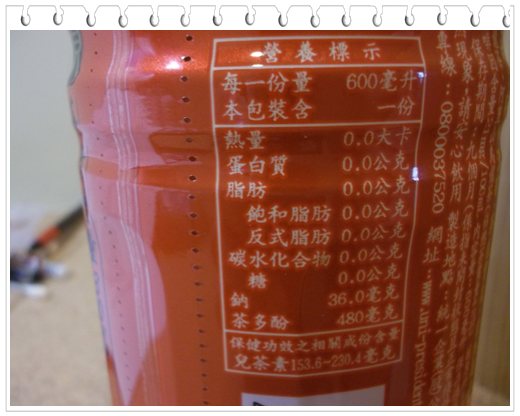
At what (x,y) coordinates should I click in order to perform the action: click on floor. Please return your answer as a coordinate pair (x, y). This screenshot has width=520, height=416. Looking at the image, I should click on (66, 334).